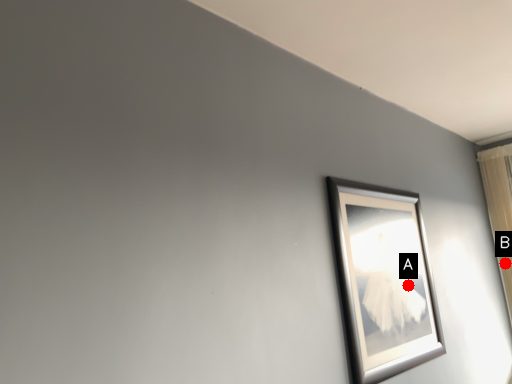
Question: Two points are circled on the image, labeled by A and B beside each circle. Which point is farther to the camera?

Choices:
 (A) A is further
 (B) B is further

Answer: (B)